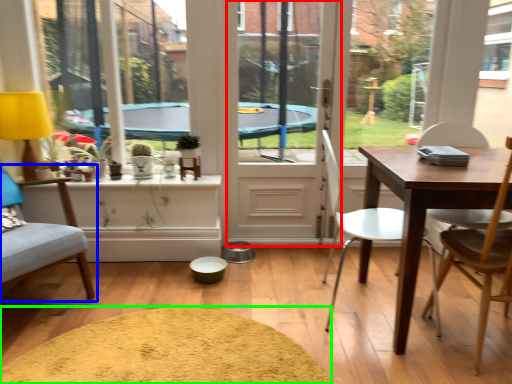
Question: Which is nearer to the screen door (highlighted by a red box)? chair (highlighted by a blue box) or wide (highlighted by a green box).

Choices:
 (A) chair
 (B) wide

Answer: (B)